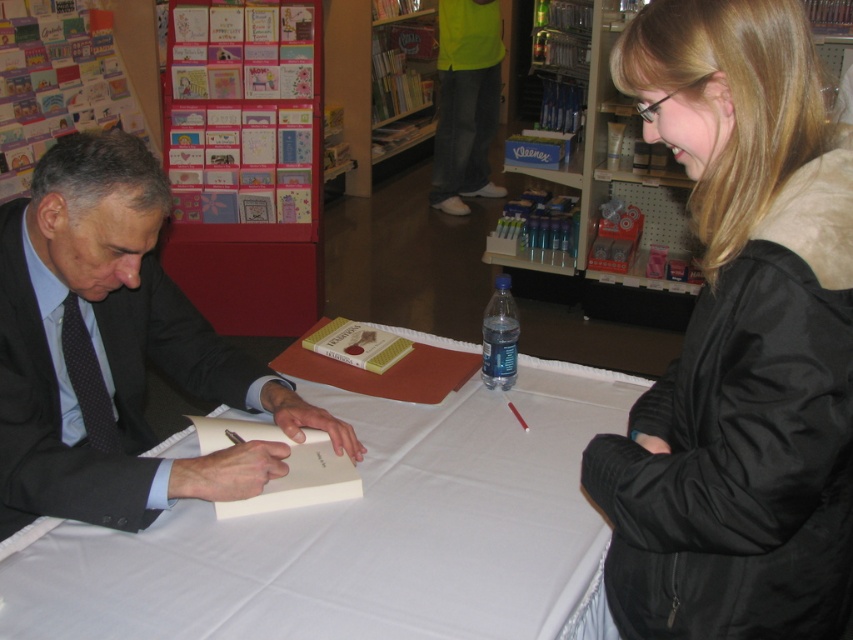
You are a customer in the bookstore and want to place an order for a gift. You need to choose between the black fuzzy coat at upper right and the cardboard greeting cards at upper left. The store has a policy that items more than 2.5 meters apart cannot be bundled together. Can these two items be bundled?

The black fuzzy coat at upper right and cardboard greeting cards at upper left are 2.67 meters apart, which exceeds the 2.5 meters limit. Therefore, they cannot be bundled together.